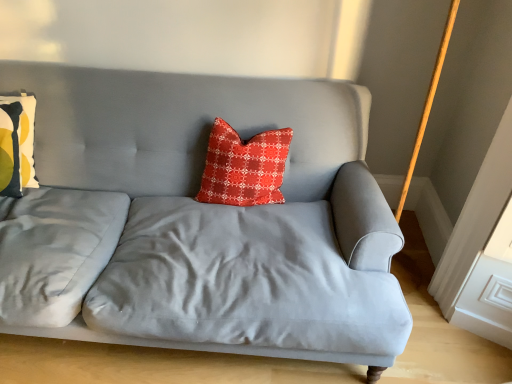
Question: Are red textured pillow at center, which is the second pillow in left-to-right order, and matte yellow-green pillow at left, placed as the second pillow when sorted from right to left, located far from each other?

Choices:
 (A) no
 (B) yes

Answer: (A)

Question: From the image's perspective, is red textured pillow at center, which is counted as the 1th pillow, starting from the right, located beneath matte yellow-green pillow at left, which is the 1th pillow from left to right?

Choices:
 (A) no
 (B) yes

Answer: (A)

Question: Is red textured pillow at center, which is the second pillow in left-to-right order, surrounding matte yellow-green pillow at left, which is the 1th pillow from left to right?

Choices:
 (A) yes
 (B) no

Answer: (B)

Question: Considering the relative sizes of red textured pillow at center, which is the second pillow in left-to-right order, and matte yellow-green pillow at left, which is the 1th pillow from left to right, in the image provided, is red textured pillow at center, which is the second pillow in left-to-right order, wider than matte yellow-green pillow at left, which is the 1th pillow from left to right,?

Choices:
 (A) no
 (B) yes

Answer: (B)

Question: From a real-world perspective, is red textured pillow at center, which is the second pillow in left-to-right order, under matte yellow-green pillow at left, which is the 1th pillow from left to right?

Choices:
 (A) no
 (B) yes

Answer: (A)

Question: Based on their sizes in the image, would you say satin gray couch at center is bigger or smaller than red textured pillow at center, which is the second pillow in left-to-right order?

Choices:
 (A) small
 (B) big

Answer: (B)

Question: Is satin gray couch at center wider or thinner than red textured pillow at center, which is counted as the 1th pillow, starting from the right?

Choices:
 (A) wide
 (B) thin

Answer: (A)

Question: From the image's perspective, is satin gray couch at center above or below red textured pillow at center, which is the second pillow in left-to-right order?

Choices:
 (A) below
 (B) above

Answer: (A)

Question: Is point (38, 79) closer or farther from the camera than point (216, 153)?

Choices:
 (A) farther
 (B) closer

Answer: (A)

Question: In terms of height, does satin gray couch at center look taller or shorter compared to matte yellow-green pillow at left, placed as the second pillow when sorted from right to left?

Choices:
 (A) tall
 (B) short

Answer: (A)

Question: In the image, is satin gray couch at center positioned in front of or behind matte yellow-green pillow at left, which is the 1th pillow from left to right?

Choices:
 (A) front
 (B) behind

Answer: (A)

Question: Considering the relative positions of satin gray couch at center and matte yellow-green pillow at left, which is the 1th pillow from left to right, in the image provided, is satin gray couch at center to the left or to the right of matte yellow-green pillow at left, which is the 1th pillow from left to right,?

Choices:
 (A) right
 (B) left

Answer: (A)

Question: Do you think satin gray couch at center is within matte yellow-green pillow at left, which is the 1th pillow from left to right, or outside of it?

Choices:
 (A) inside
 (B) outside

Answer: (B)

Question: Visually, is matte yellow-green pillow at left, placed as the second pillow when sorted from right to left, positioned to the left or to the right of satin gray couch at center?

Choices:
 (A) right
 (B) left

Answer: (B)

Question: Which is correct: matte yellow-green pillow at left, placed as the second pillow when sorted from right to left, is inside satin gray couch at center, or outside of it?

Choices:
 (A) outside
 (B) inside

Answer: (B)